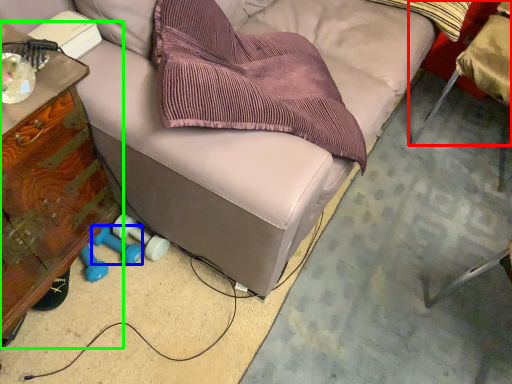
Question: Based on their relative distances, which object is farther from chair (highlighted by a red box)? Choose from dumbbell (highlighted by a blue box) and furniture (highlighted by a green box).

Choices:
 (A) dumbbell
 (B) furniture

Answer: (B)